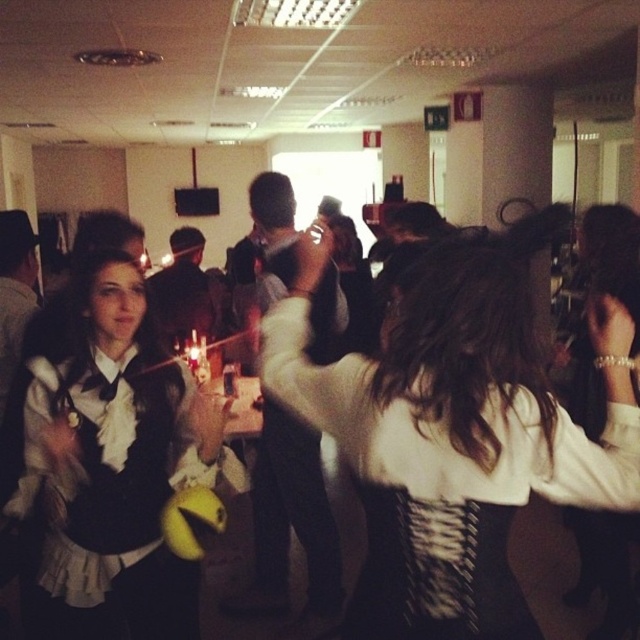
Question: Is white textured fabric at center smaller than matte black dress at center?

Choices:
 (A) yes
 (B) no

Answer: (B)

Question: Does white textured fabric at center come behind matte black dress at center?

Choices:
 (A) no
 (B) yes

Answer: (A)

Question: Which of the following is the closest to the observer?

Choices:
 (A) matte black dress at center
 (B) white textured fabric at center

Answer: (B)

Question: Is white textured fabric at center above matte black dress at center?

Choices:
 (A) no
 (B) yes

Answer: (B)

Question: Which point is closer to the camera taking this photo?

Choices:
 (A) (77, 332)
 (B) (632, 476)

Answer: (B)

Question: Which point appears farthest from the camera in this image?

Choices:
 (A) (189, 477)
 (B) (438, 632)

Answer: (A)